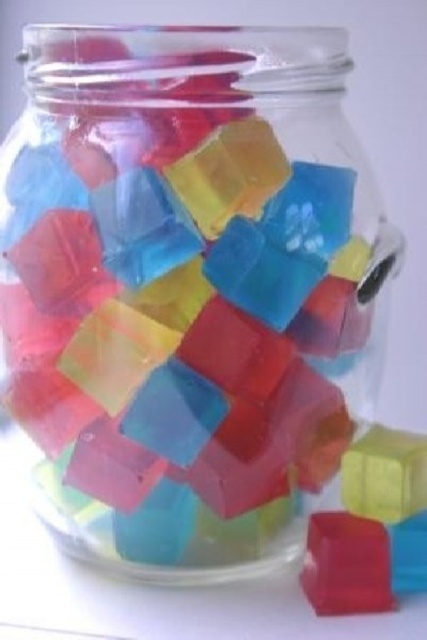
You are holding a small toy that needs to be placed into the jar. The toy is exactly the same size as the translucent plastic cube at center. Where should you place it so that it is in the same position relative to the translucent rubber cube at lower right as the original cubes?

You should place the toy so that it is closer to the viewer than the translucent rubber cube at lower right, mirroring the position of the translucent plastic cube at center which is already closer to the viewer than the translucent rubber cube at lower right.

Please describe the position of the translucent plastic cube at center in the glass jar using coordinates. The coordinate system has the origin at the bottom left corner of the jar, with the x and y axes increasing to the right and upward respectively. The jar has a width of 1 unit and a height of 1 unit. What are its coordinates?

The translucent plastic cube at center is located at coordinates approximately 0.825 in the x direction and 0.869 in the y direction.